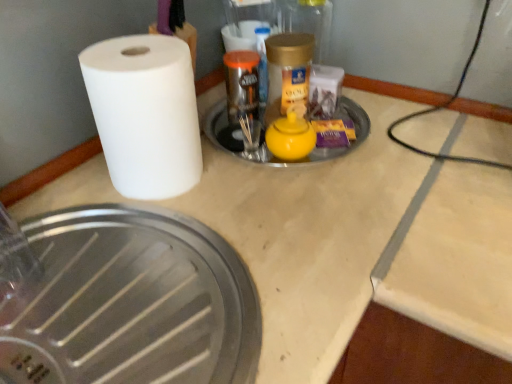
The height and width of the screenshot is (384, 512). Find the location of `vacant space situated above yellow matte teapot at center, the first manhole cover from the top (from a real-world perspective)`. vacant space situated above yellow matte teapot at center, the first manhole cover from the top (from a real-world perspective) is located at coordinates (267, 125).